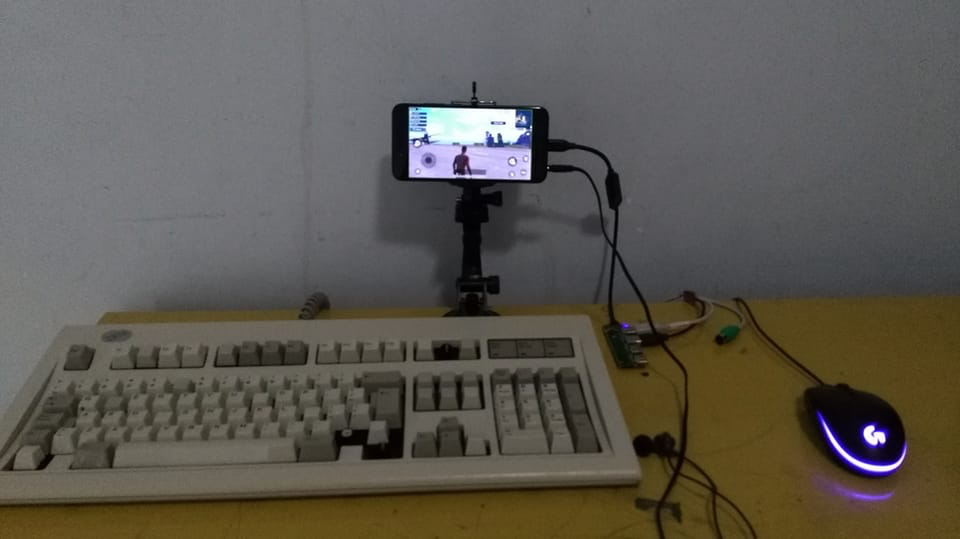
At what (x,y) coordinates should I click in order to perform the action: click on table. Please return your answer as a coordinate pair (x, y). The width and height of the screenshot is (960, 539). Looking at the image, I should click on (763, 393).